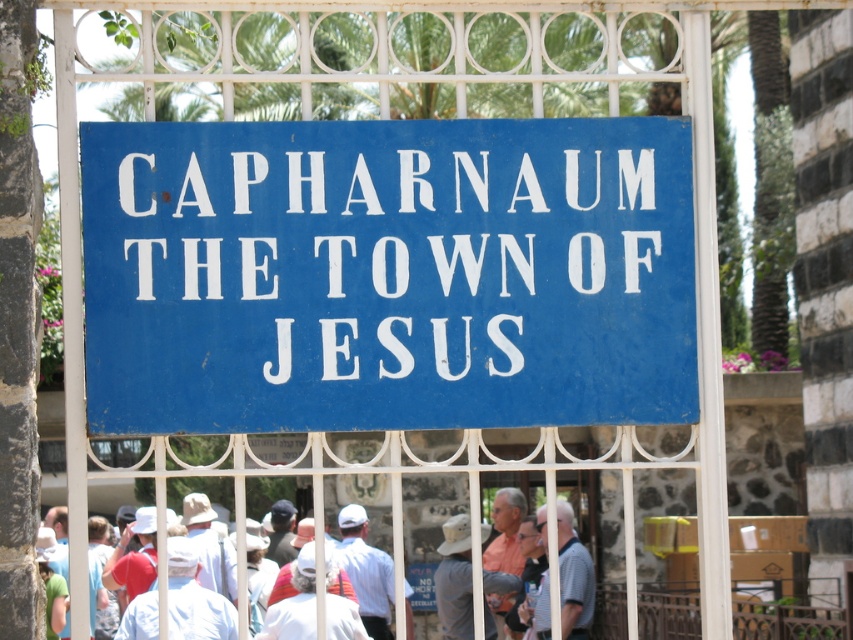
Question: Is blue painted metal sign at center smaller than white cotton shirt at center?

Choices:
 (A) no
 (B) yes

Answer: (B)

Question: Which of the following is the closest to the observer?

Choices:
 (A) blue painted metal sign at center
 (B) light blue shirt at center
 (C) white cotton shirt at center

Answer: (A)

Question: Does blue painted metal sign at center have a smaller size compared to white cotton shirt at center?

Choices:
 (A) no
 (B) yes

Answer: (B)

Question: Which of the following is the closest to the observer?

Choices:
 (A) click(350, 516)
 (B) click(561, 568)
 (C) click(659, 141)

Answer: (C)

Question: Observing the image, what is the correct spatial positioning of light blue shirt at center in reference to white cotton shirt at center?

Choices:
 (A) above
 (B) below

Answer: (A)

Question: Which point is farther from the camera taking this photo?

Choices:
 (A) (582, 621)
 (B) (546, 621)

Answer: (A)